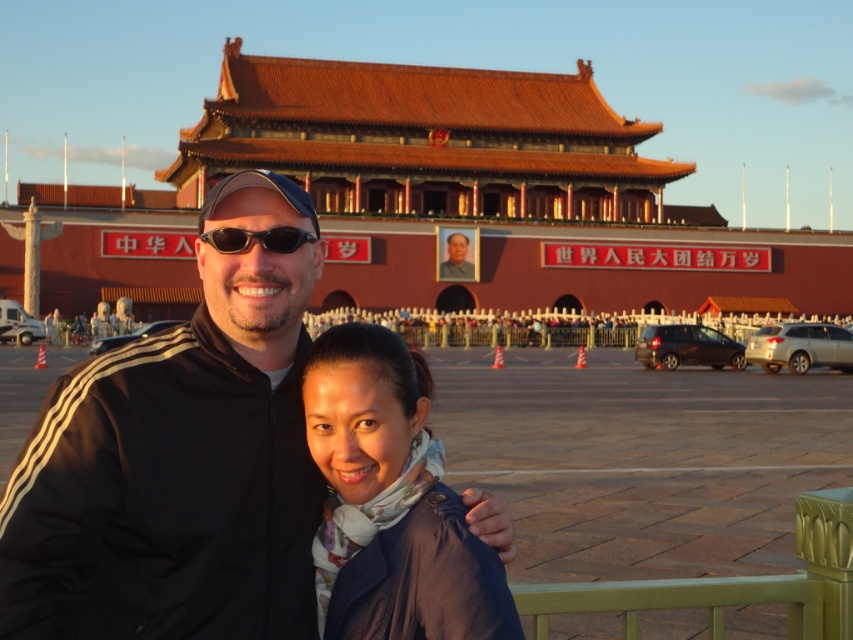
Question: Is black fabric jacket at center behind matte black jacket at center?

Choices:
 (A) yes
 (B) no

Answer: (B)

Question: Which point is farther to the camera?

Choices:
 (A) black fabric jacket at center
 (B) matte black jacket at center
 (C) black plastic sunglasses at center
 (D) reddish-brown tiled roof at center

Answer: (D)

Question: Which of these objects is positioned farthest from the black fabric jacket at center?

Choices:
 (A) matte black jacket at center
 (B) reddish-brown tiled roof at center
 (C) smooth skin portrait at center

Answer: (B)

Question: Does black fabric jacket at center appear under matte black jacket at center?

Choices:
 (A) no
 (B) yes

Answer: (B)

Question: Which of the following is the farthest from the observer?

Choices:
 (A) reddish-brown tiled roof at center
 (B) black fabric jacket at center
 (C) black plastic sunglasses at center

Answer: (A)

Question: Does reddish-brown tiled roof at center have a lesser width compared to smooth skin portrait at center?

Choices:
 (A) yes
 (B) no

Answer: (B)